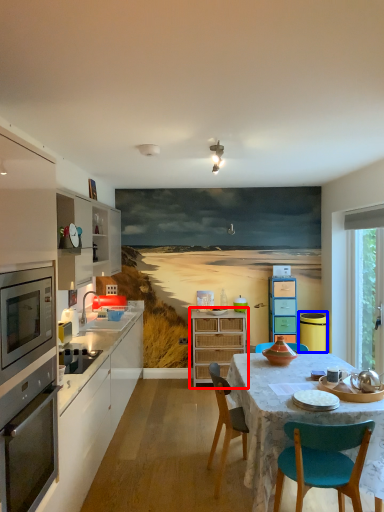
Question: Which object appears farthest to the camera in this image, cabinetry (highlighted by a red box) or appliance (highlighted by a blue box)?

Choices:
 (A) cabinetry
 (B) appliance

Answer: (A)